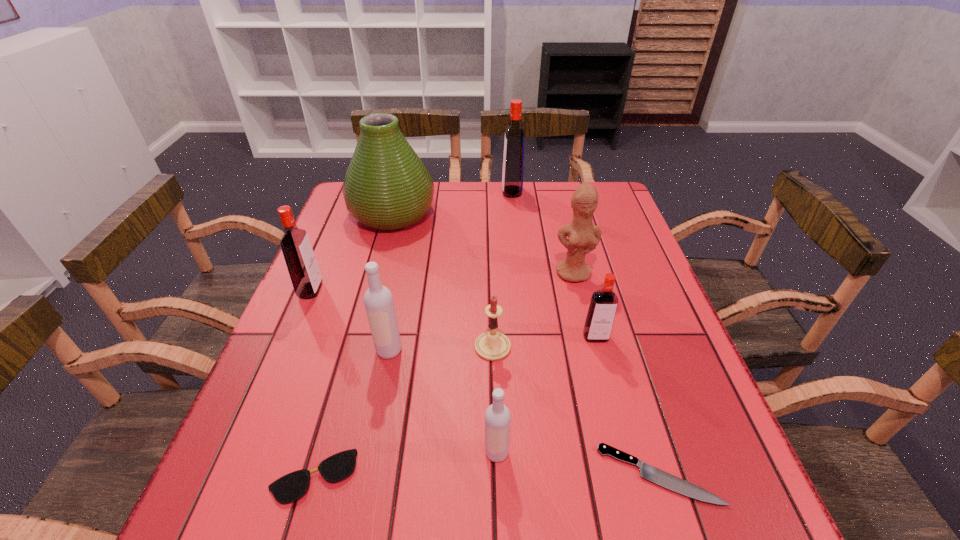
The width and height of the screenshot is (960, 540). What are the coordinates of `vacant position located on the front-facing side of the figurine` in the screenshot? It's located at (594, 355).

Identify the location of vacant space located on the right of the farther white vodka. The image size is (960, 540). (480, 350).

I want to click on vacant space located on the front and back of the second smallest red vodka, so click(353, 290).

This screenshot has width=960, height=540. What are the coordinates of `free space located 0.350m on the front and back of the rightmost red vodka` in the screenshot? It's located at (640, 509).

Identify the location of free space located 0.360m on the back of the right white vodka. This screenshot has height=540, width=960. (492, 303).

You are a GUI agent. You are given a task and a screenshot of the screen. Output one action in this format:
    pyautogui.click(x=<x>, y=<y>)
    Task: Click on the vacant space located on the right of the third shortest object
    The height and width of the screenshot is (540, 960).
    Given the screenshot: What is the action you would take?
    pyautogui.click(x=584, y=347)

I want to click on vacant space located on the back of the spectacles, so click(338, 388).

Identify the location of free space located on the left of the steak knife. The height and width of the screenshot is (540, 960). (386, 475).

You are a GUI agent. You are given a task and a screenshot of the screen. Output one action in this format:
    pyautogui.click(x=<x>, y=<y>)
    Task: Click on the vodka that is at the far edge
    This screenshot has width=960, height=540.
    Given the screenshot: What is the action you would take?
    pyautogui.click(x=513, y=160)

What are the coordinates of `vase present at the far edge` in the screenshot? It's located at (386, 187).